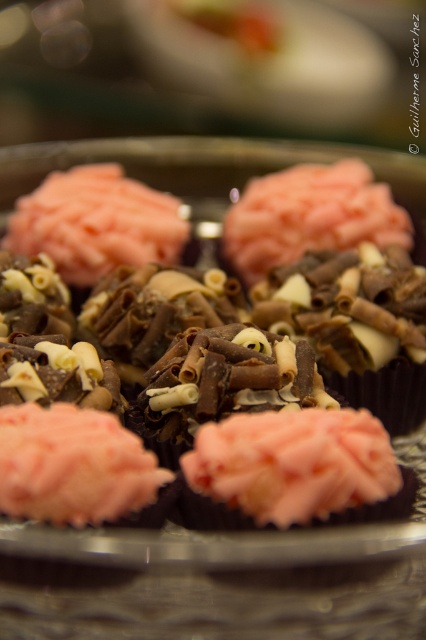
Can you confirm if pink matte frosting at center is positioned to the left of pink frosted cupcake at lower left?

No, pink matte frosting at center is not to the left of pink frosted cupcake at lower left.

What are the coordinates of `pink matte frosting at center` in the screenshot? It's located at click(293, 461).

What are the coordinates of `pink matte frosting at center` in the screenshot? It's located at (293, 461).

Find the location of a particular element. pink frosted cupcake at center is located at coordinates (181, 401).

Who is shorter, pink frosted cupcake at center or pink matte frosting at center?

With less height is pink matte frosting at center.

Locate an element on the screen. This screenshot has height=640, width=426. pink frosted cupcake at center is located at coordinates (181, 401).

Does point (83, 307) lie in front of point (8, 458)?

That is False.

Does pink frosted cupcake at center appear under pink frosted cupcake at lower left?

Incorrect, pink frosted cupcake at center is not positioned below pink frosted cupcake at lower left.

Locate an element on the screen. Image resolution: width=426 pixels, height=640 pixels. pink frosted cupcake at center is located at coordinates (181, 401).